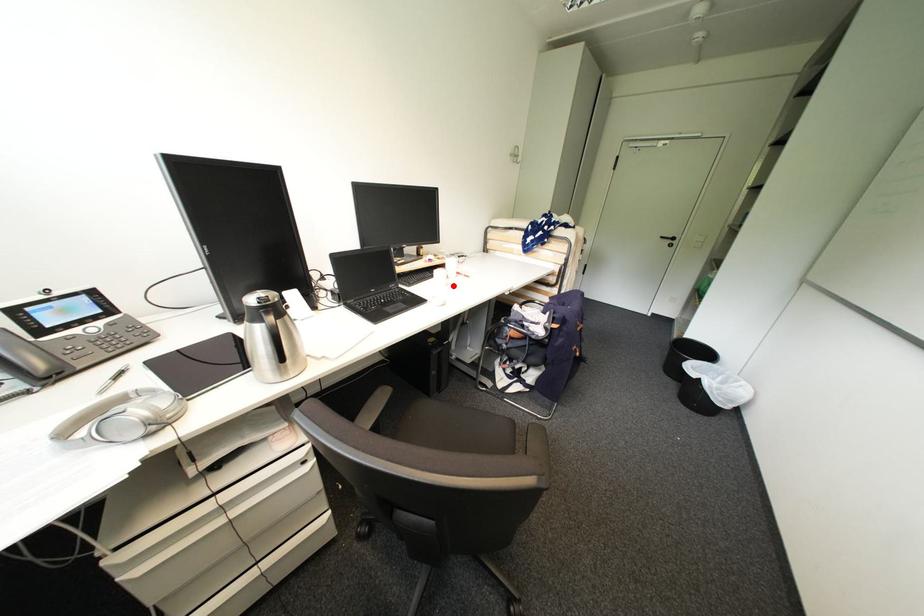
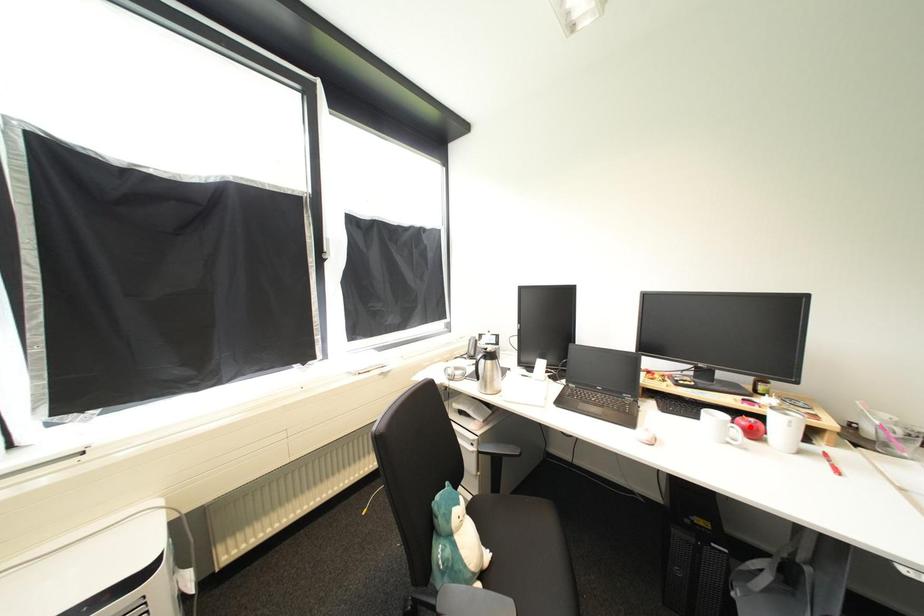
I am providing you with two images of the same scene from different viewpoints. A red point is marked on the first image and another point is marked on the second image. Is the red point in image1 aligned with the point shown in image2?

No